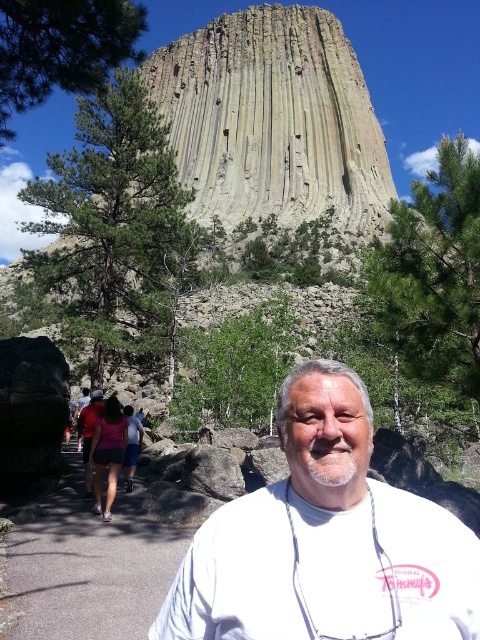
Does white matte t-shirt at center have a smaller size compared to gray asphalt path at center?

No, white matte t-shirt at center is not smaller than gray asphalt path at center.

What do you see at coordinates (325, 540) in the screenshot? I see `white matte t-shirt at center` at bounding box center [325, 540].

This screenshot has width=480, height=640. Identify the location of white matte t-shirt at center. (325, 540).

Who is more forward, (443, 525) or (447, 170)?

Point (443, 525) is more forward.

Between white matte t-shirt at center and green textured pine at upper center, which one is positioned higher?

green textured pine at upper center

Between point (333, 532) and point (435, 196), which one is positioned behind?

The point (435, 196) is behind.

The height and width of the screenshot is (640, 480). Identify the location of white matte t-shirt at center. (325, 540).

Consider the image. Does white matte t-shirt at center have a greater height compared to green textured pine tree at left?

No, white matte t-shirt at center is not taller than green textured pine tree at left.

In order to click on white matte t-shirt at center in this screenshot , I will do `click(325, 540)`.